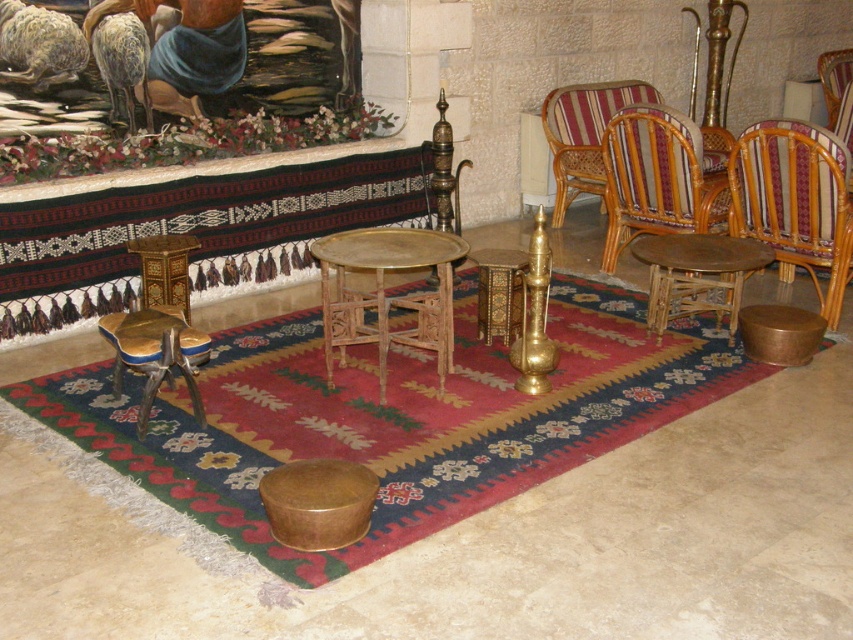
Where is `gold-bronze table at center`? The image size is (853, 640). gold-bronze table at center is located at coordinates (386, 292).

Measure the distance from gold-bronze table at center to gold polished stool at lower left.

A distance of 25.62 inches exists between gold-bronze table at center and gold polished stool at lower left.

Find the location of a particular element. This screenshot has width=853, height=640. gold-bronze table at center is located at coordinates (386, 292).

Can you confirm if rattan armchair at center is wider than gold textured stool at center?

Yes.

Based on the photo, who is taller, rattan armchair at center or gold textured stool at center?

rattan armchair at center is taller.

Is point (624, 154) behind point (503, 333)?

Yes, it is.

Locate an element on the screen. The height and width of the screenshot is (640, 853). rattan armchair at center is located at coordinates (657, 179).

Does woven rattan armchair at right have a greater height compared to gold-bronze table at center?

Indeed, woven rattan armchair at right has a greater height compared to gold-bronze table at center.

Is woven rattan armchair at right positioned at the back of gold-bronze table at center?

Yes.

Is point (851, 244) in front of point (335, 275)?

No, it is behind (335, 275).

At what (x,y) coordinates should I click in order to perform the action: click on woven rattan armchair at right. Please return your answer as a coordinate pair (x, y). Looking at the image, I should click on (795, 202).